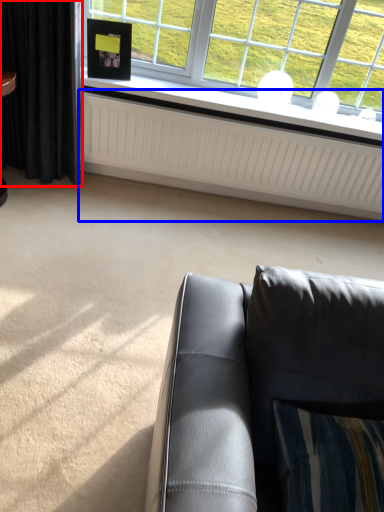
Question: Which of the following is the closest to the observer, curtain (highlighted by a red box) or radiator (highlighted by a blue box)?

Choices:
 (A) curtain
 (B) radiator

Answer: (A)